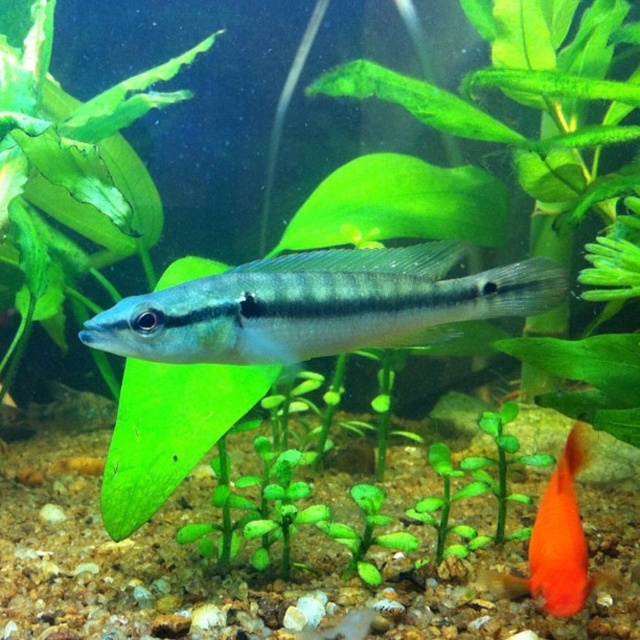
Question: Where is satin silver fish at center located in relation to orange glossy fish at lower right in the image?

Choices:
 (A) right
 (B) left

Answer: (B)

Question: Can you confirm if satin silver fish at center is smaller than orange glossy fish at lower right?

Choices:
 (A) no
 (B) yes

Answer: (B)

Question: Observing the image, what is the correct spatial positioning of satin silver fish at center in reference to orange glossy fish at lower right?

Choices:
 (A) above
 (B) below

Answer: (A)

Question: Which point is farther from the camera taking this photo?

Choices:
 (A) (572, 592)
 (B) (202, 288)

Answer: (A)

Question: Which of the following is the closest to the observer?

Choices:
 (A) (545, 544)
 (B) (195, 358)

Answer: (B)